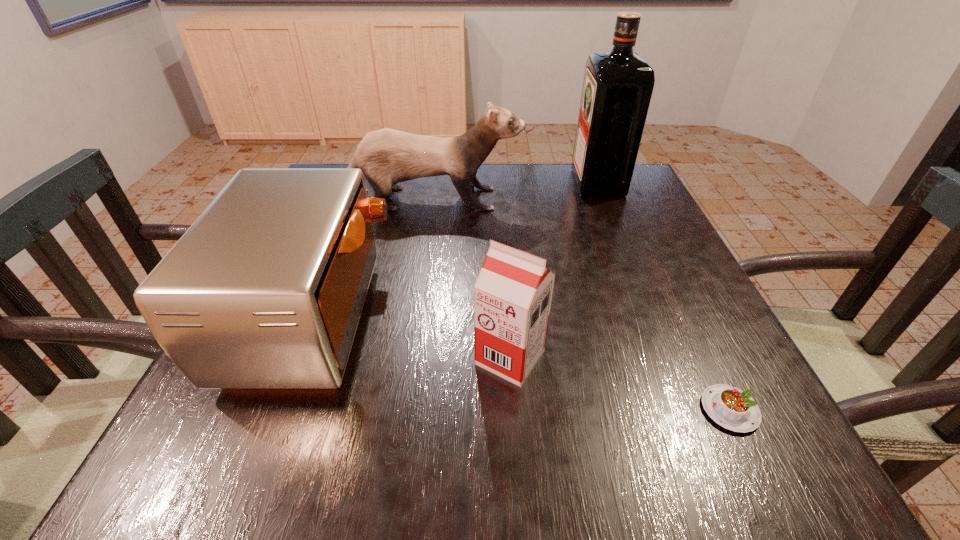
Where is `the tallest object`? the tallest object is located at coordinates (617, 88).

At what (x,y) coordinates should I click in order to perform the action: click on ferret. Please return your answer as a coordinate pair (x, y). The width and height of the screenshot is (960, 540). Looking at the image, I should click on (386, 157).

What are the coordinates of `soya milk` in the screenshot? It's located at (513, 293).

This screenshot has width=960, height=540. Find the location of `toaster oven`. toaster oven is located at coordinates (265, 290).

The width and height of the screenshot is (960, 540). Identify the location of the shortest object. (733, 409).

You are a GUI agent. You are given a task and a screenshot of the screen. Output one action in this format:
    pyautogui.click(x=<x>, y=<y>)
    Task: Click on the free location located on the front label of the liquor
    The image size is (960, 540).
    Given the screenshot: What is the action you would take?
    pyautogui.click(x=450, y=183)

At what (x,y) coordinates should I click in order to perform the action: click on vacant region located on the front label of the liquor. Please return your answer as a coordinate pair (x, y). Looking at the image, I should click on (472, 183).

Find the location of a particular element. The height and width of the screenshot is (540, 960). vacant space located 0.100m on the front label of the liquor is located at coordinates (539, 183).

The width and height of the screenshot is (960, 540). In order to click on free spot located 0.260m on the face of the ferret in this screenshot , I will do `click(622, 199)`.

Find the location of a particular element. The width and height of the screenshot is (960, 540). free point located on the left of the soya milk is located at coordinates (252, 357).